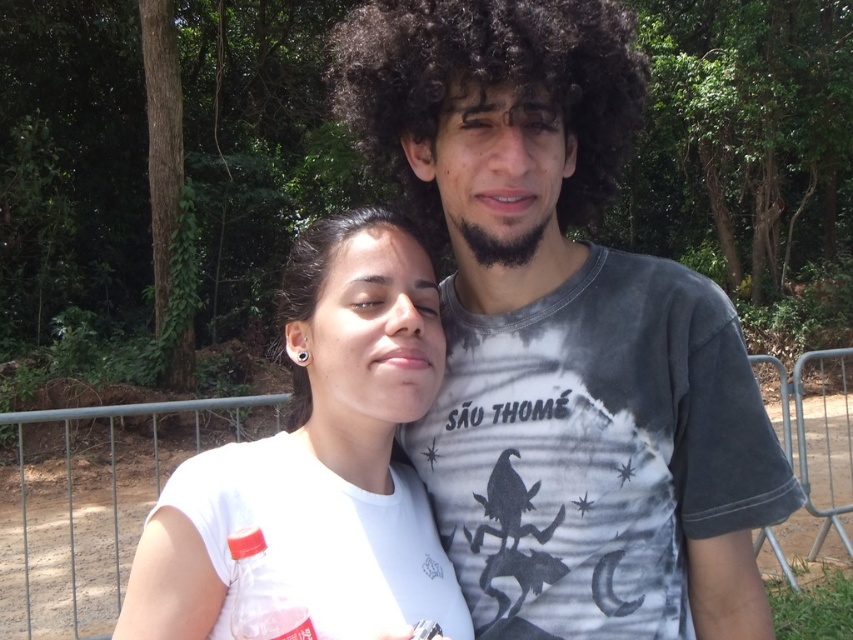
Between point (573, 113) and point (334, 241), which one is positioned in front?

Point (573, 113)

Locate an element on the screen. dark curly hair at center is located at coordinates (490, 83).

Image resolution: width=853 pixels, height=640 pixels. Find the location of `dark curly hair at center`. dark curly hair at center is located at coordinates (490, 83).

Is dark gray t-shirt at center positioned before metallic gray fence at center?

Yes, it is in front of metallic gray fence at center.

Is point (448, 173) positioned after point (178, 419)?

No, it is in front of (178, 419).

This screenshot has width=853, height=640. What do you see at coordinates (563, 333) in the screenshot? I see `dark gray t-shirt at center` at bounding box center [563, 333].

Locate an element on the screen. This screenshot has height=640, width=853. dark gray t-shirt at center is located at coordinates (563, 333).

Is white matte t-shirt at center below dark curly hair at center?

Correct, white matte t-shirt at center is located below dark curly hair at center.

What do you see at coordinates (320, 458) in the screenshot?
I see `white matte t-shirt at center` at bounding box center [320, 458].

Between point (393, 369) and point (608, 173), which one is positioned behind?

The point (608, 173) is more distant.

Find the location of a particular element. white matte t-shirt at center is located at coordinates (320, 458).